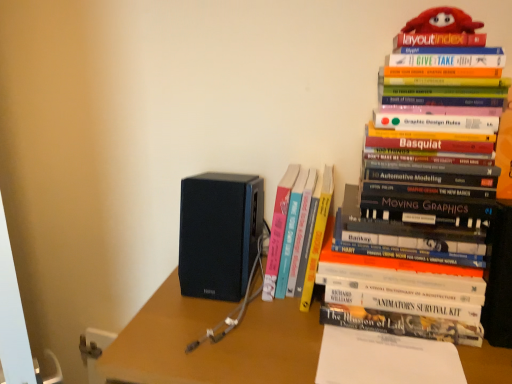
This screenshot has height=384, width=512. I want to click on free region under white paper at center (from a real-world perspective), so click(x=383, y=356).